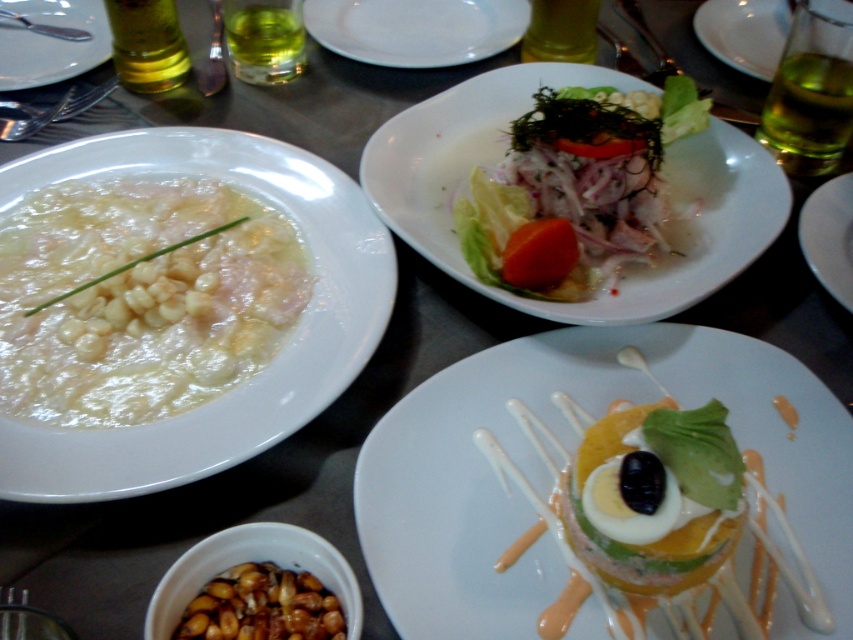
You are arranging a dinner table and need to place a centerpiece between the white glossy plate at upper left and the matte white plate at upper right. Which plate should you place the centerpiece closer to if you want it to balance the visual weight of the two plates?

The white glossy plate at upper left occupies less space than the matte white plate at upper right, so you should place the centerpiece closer to the matte white plate at upper right to balance the visual weight between them.

You are a chef tasting dishes at a food competition. You have two dishes in front of you on the table. One is the white glossy dessert at center and the other is the white creamy soup at left. The competition requires that the dish with the greater thickness should be served in a deeper bowl. Which dish should you choose to place in the deeper bowl?

The white creamy soup at left should be placed in the deeper bowl because it is thicker than the white glossy dessert at center.